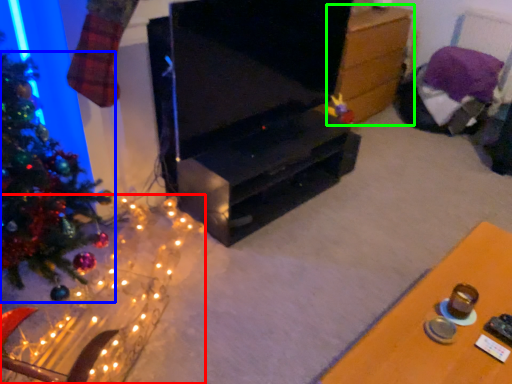
Question: Which object is positioned farthest from christmas decoration (highlighted by a red box)? Select from christmas tree (highlighted by a blue box) and table (highlighted by a green box).

Choices:
 (A) christmas tree
 (B) table

Answer: (B)